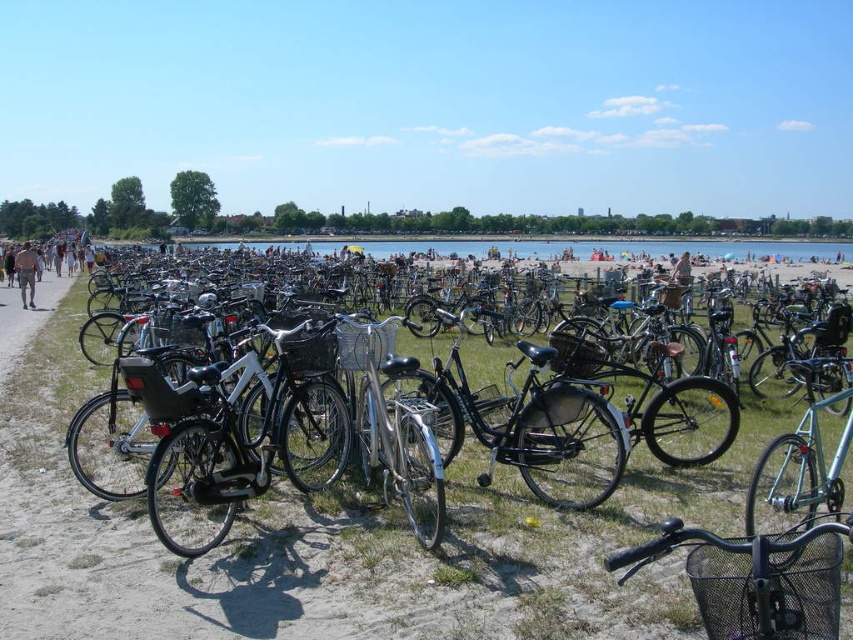
Can you confirm if green grass at center is taller than black matte bicycle at center?

Correct, green grass at center is much taller as black matte bicycle at center.

Is point (321, 592) more distant than point (811, 560)?

Yes, it is behind point (811, 560).

I want to click on green grass at center, so click(329, 541).

Consider the image. Is black matte bicycle at center thinner than tan skin person at left?

Indeed, black matte bicycle at center has a lesser width compared to tan skin person at left.

The image size is (853, 640). Describe the element at coordinates (753, 579) in the screenshot. I see `black matte bicycle at center` at that location.

Is point (730, 580) positioned behind point (18, 284)?

That is False.

Identify the location of black matte bicycle at center. (753, 579).

Consider the image. Is tan skin person at left smaller than brown leather jacket at left?

Incorrect, tan skin person at left is not smaller in size than brown leather jacket at left.

Based on the photo, between tan skin person at left and brown leather jacket at left, which one is positioned lower?

brown leather jacket at left

Does point (39, 266) come in front of point (30, 268)?

No, it is not.

At what (x,y) coordinates should I click in order to perform the action: click on tan skin person at left. Please return your answer as a coordinate pair (x, y). This screenshot has height=640, width=853. Looking at the image, I should click on (26, 273).